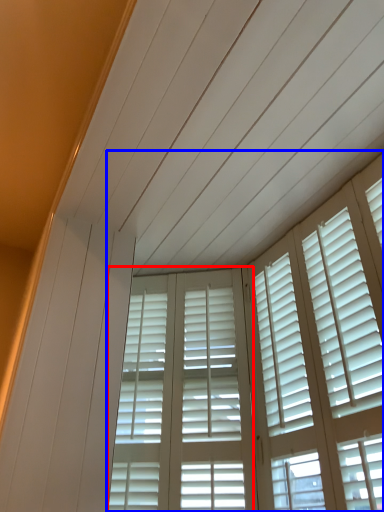
Question: Which of the following is the farthest to the observer, screen door (highlighted by a red box) or window (highlighted by a blue box)?

Choices:
 (A) screen door
 (B) window

Answer: (A)